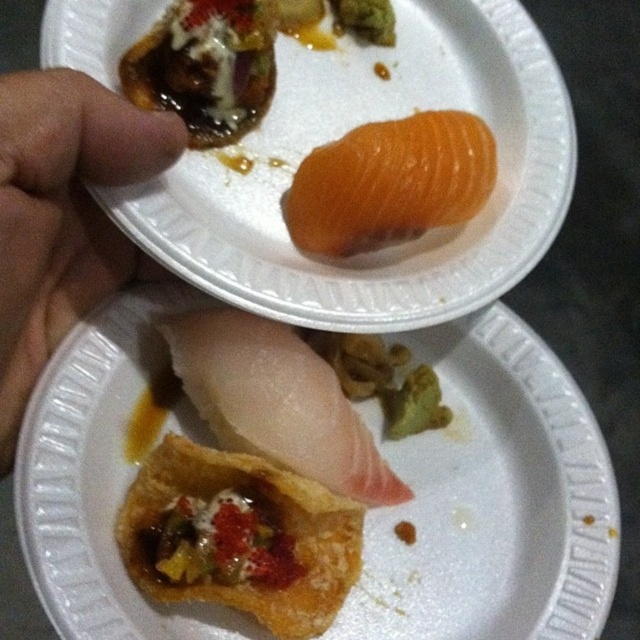
This screenshot has width=640, height=640. What do you see at coordinates (342, 132) in the screenshot?
I see `orange fleshed fish at upper center` at bounding box center [342, 132].

Between orange fleshed fish at upper center and orange smooth salmon at upper center, which one has more height?

orange fleshed fish at upper center

Who is more distant from viewer, (x=291, y=305) or (x=369, y=216)?

The point (x=369, y=216) is more distant.

The height and width of the screenshot is (640, 640). In order to click on orange fleshed fish at upper center in this screenshot , I will do `click(342, 132)`.

Between white raw fish at center and slightly translucent orange at upper right, which one has more height?

white raw fish at center

Can you confirm if white raw fish at center is positioned above slightly translucent orange at upper right?

Incorrect, white raw fish at center is not positioned above slightly translucent orange at upper right.

Is point (273, 403) farther from viewer compared to point (228, 48)?

No, it is in front of (228, 48).

You are a GUI agent. You are given a task and a screenshot of the screen. Output one action in this format:
    pyautogui.click(x=<x>, y=<y>)
    Task: Click on the white raw fish at center
    The image size is (640, 640).
    Given the screenshot: What is the action you would take?
    pyautogui.click(x=276, y=401)

Between flesh-toned skin at upper left and white raw fish at center, which one has more height?

With more height is flesh-toned skin at upper left.

Between flesh-toned skin at upper left and white raw fish at center, which one appears on the right side from the viewer's perspective?

white raw fish at center

Which is in front, point (8, 131) or point (179, 346)?

Positioned in front is point (8, 131).

You are a GUI agent. You are given a task and a screenshot of the screen. Output one action in this format:
    pyautogui.click(x=<x>, y=<y>)
    Task: Click on the flesh-toned skin at upper left
    The image size is (640, 640).
    Given the screenshot: What is the action you would take?
    pyautogui.click(x=64, y=216)